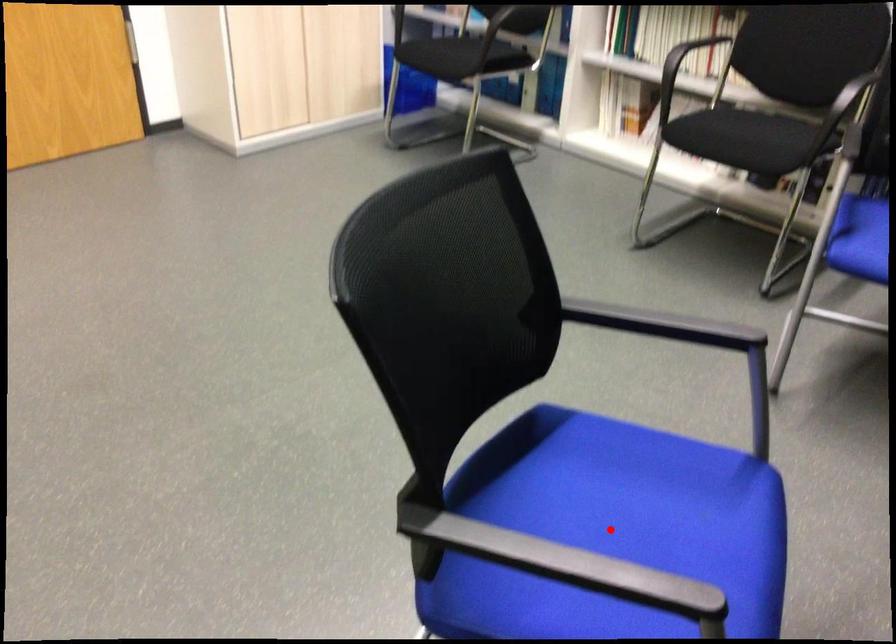
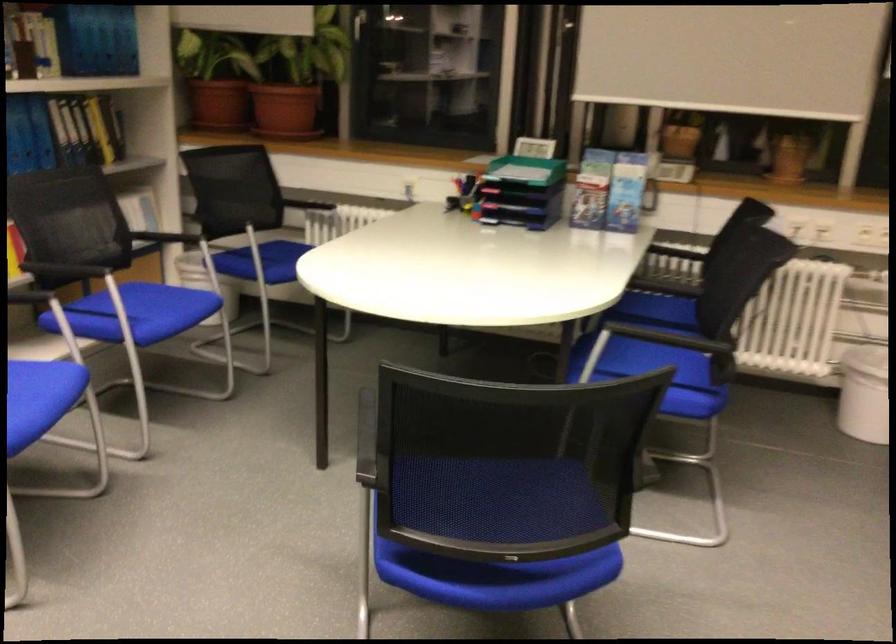
Question: I am providing you with two images of the same scene from different viewpoints. A red point is marked on the first image. At the location where the point appears in image 1, is it still visible in image 2?

Choices:
 (A) Yes
 (B) No

Answer: (B)